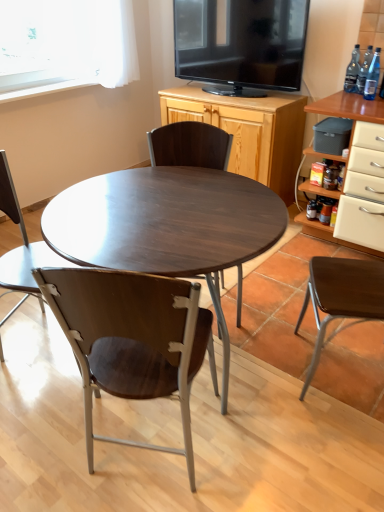
Where is `vacant area to the right of dark wood chair at center, acting as the 2th chair starting from the right`? The image size is (384, 512). vacant area to the right of dark wood chair at center, acting as the 2th chair starting from the right is located at coordinates (269, 293).